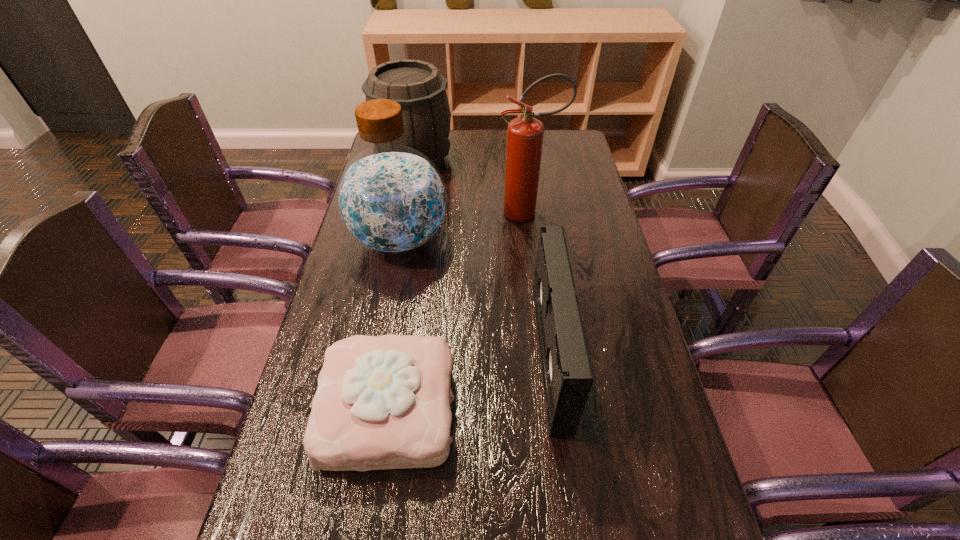
Where is `object present at the far left corner`? object present at the far left corner is located at coordinates (419, 88).

Locate an element on the screen. The height and width of the screenshot is (540, 960). vacant space at the far edge is located at coordinates click(x=464, y=131).

In the image, there is a desktop. At what (x,y) coordinates should I click in order to perform the action: click on vacant space at the left edge. Please return your answer as a coordinate pair (x, y). This screenshot has height=540, width=960. Looking at the image, I should click on (321, 367).

This screenshot has height=540, width=960. I want to click on vacant area at the right edge of the desktop, so click(x=601, y=404).

Locate an element on the screen. The image size is (960, 540). vacant area that lies between the fourth tallest object and the water jug is located at coordinates (475, 296).

The width and height of the screenshot is (960, 540). Identify the location of vacant space that's between the videotape and the farthest object. (482, 256).

Locate an element on the screen. empty space that is in between the shortest object and the water jug is located at coordinates (395, 324).

Find the location of a particular element. This screenshot has width=960, height=540. empty space between the fire extinguisher and the water jug is located at coordinates (464, 226).

Find the location of a particular element. empty space between the second shortest object and the water jug is located at coordinates (475, 296).

Identify the location of free spot between the cake and the wine bucket. This screenshot has height=540, width=960. (401, 284).